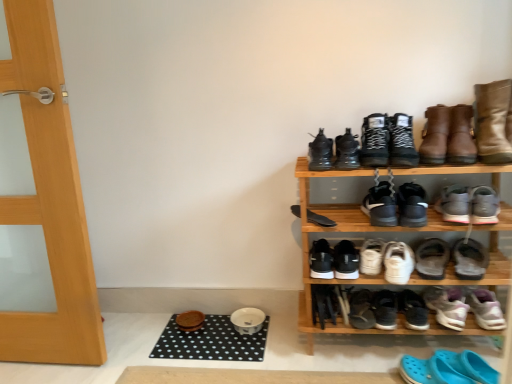
The width and height of the screenshot is (512, 384). Describe the element at coordinates (398, 262) in the screenshot. I see `white matte sneakers at center-right, placed as the thirteenth footwear when sorted from top to bottom` at that location.

What do you see at coordinates (321, 260) in the screenshot? The height and width of the screenshot is (384, 512). I see `black matte shoe at lower center, the seventh footwear when ordered from bottom to top` at bounding box center [321, 260].

What do you see at coordinates (470, 259) in the screenshot? Image resolution: width=512 pixels, height=384 pixels. I see `white suede sneaker at lower right, the eleventh footwear positioned from the top` at bounding box center [470, 259].

Identify the location of white matte sneakers at center, the 6th footwear ordered from the bottom. (x=432, y=258).

The image size is (512, 384). What do you see at coordinates (492, 121) in the screenshot? I see `leather boots at upper right, placed as the 20th footwear when sorted from bottom to top` at bounding box center [492, 121].

Describe the element at coordinates (49, 200) in the screenshot. I see `wooden door at left` at that location.

At what (x,y) coordinates should I click in order to perform the action: click on white matte sneakers at center-right, the eighth footwear when ordered from bottom to top. Please return your answer as a coordinate pair (x, y). The image size is (512, 384). Looking at the image, I should click on (398, 262).

From the image's perspective, which one is positioned higher, black dotted mat at lower center, the 2th doormat from the front, or black matte shoe at lower center, the 2th footwear from the bottom?

black matte shoe at lower center, the 2th footwear from the bottom, appears higher in the image.

From a real-world perspective, between black dotted mat at lower center, the first doormat in the back-to-front sequence, and black matte shoe at lower center, the nineteenth footwear positioned from the top, who is vertically lower?

From a 3D spatial view, black dotted mat at lower center, the first doormat in the back-to-front sequence, is below.

From the black dotted mat at lower center, the first doormat in the back-to-front sequence, count 1st footwears forward and point to it. Please provide its 2D coordinates.

[(361, 309)]

Looking at this image, between black dotted mat at lower center, the 2th doormat from the front, and black matte shoe at lower center, the 2th footwear from the bottom, which one has smaller width?

Thinner between the two is black matte shoe at lower center, the 2th footwear from the bottom.

Considering the sizes of white matte sneakers at center, which ranks as the 12th footwear in top-to-bottom order, and black suede boots at upper center, the 18th footwear positioned from the bottom, in the image, is white matte sneakers at center, which ranks as the 12th footwear in top-to-bottom order, bigger or smaller than black suede boots at upper center, the 18th footwear positioned from the bottom,?

In the image, white matte sneakers at center, which ranks as the 12th footwear in top-to-bottom order, appears to be smaller than black suede boots at upper center, the 18th footwear positioned from the bottom.

How different are the orientations of white matte sneakers at center, which ranks as the 12th footwear in top-to-bottom order, and black suede boots at upper center, the 18th footwear positioned from the bottom, in degrees?

There is a 12.6-degree angle between the facing directions of white matte sneakers at center, which ranks as the 12th footwear in top-to-bottom order, and black suede boots at upper center, the 18th footwear positioned from the bottom.

Considering the sizes of white matte sneakers at center, which is counted as the ninth footwear, starting from the bottom, and black suede boots at upper center, which is the third footwear from top to bottom, in the image, is white matte sneakers at center, which is counted as the ninth footwear, starting from the bottom, taller or shorter than black suede boots at upper center, which is the third footwear from top to bottom,?

Clearly, white matte sneakers at center, which is counted as the ninth footwear, starting from the bottom, is shorter compared to black suede boots at upper center, which is the third footwear from top to bottom.

From a real-world perspective, which object rests below the other?

white matte sneakers at center, which is counted as the ninth footwear, starting from the bottom, is physically lower.

Between white suede sneaker at lower right, the eleventh footwear positioned from the top, and white matte sneakers at center, which is counted as the ninth footwear, starting from the bottom, which one has larger size?

white suede sneaker at lower right, the eleventh footwear positioned from the top.

Which is more to the right, white suede sneaker at lower right, the 10th footwear in the bottom-to-top sequence, or white matte sneakers at center, which ranks as the 12th footwear in top-to-bottom order?

white suede sneaker at lower right, the 10th footwear in the bottom-to-top sequence, is more to the right.

Which of these two, white suede sneaker at lower right, the 10th footwear in the bottom-to-top sequence, or white matte sneakers at center, which is counted as the ninth footwear, starting from the bottom, is wider?

white suede sneaker at lower right, the 10th footwear in the bottom-to-top sequence.

Looking at this image, is white suede sneaker at lower right, the 10th footwear in the bottom-to-top sequence, positioned beyond the bounds of white matte sneakers at center, which ranks as the 12th footwear in top-to-bottom order?

Yes, white suede sneaker at lower right, the 10th footwear in the bottom-to-top sequence, is located beyond the bounds of white matte sneakers at center, which ranks as the 12th footwear in top-to-bottom order.

Would you say leather boots at upper right, placed as the 20th footwear when sorted from bottom to top, is a long distance from shiny black boot at upper center, positioned as the 16th footwear in bottom-to-top order?

No, there isn't a large distance between leather boots at upper right, placed as the 20th footwear when sorted from bottom to top, and shiny black boot at upper center, positioned as the 16th footwear in bottom-to-top order.

Is leather boots at upper right, the first footwear positioned from the top, oriented away from shiny black boot at upper center, positioned as the 16th footwear in bottom-to-top order?

No, shiny black boot at upper center, positioned as the 16th footwear in bottom-to-top order, is not at the back of leather boots at upper right, the first footwear positioned from the top.

From the image's perspective, would you say leather boots at upper right, placed as the 20th footwear when sorted from bottom to top, is shown under shiny black boot at upper center, which is the 5th footwear in top-to-bottom order?

No, from the image's perspective, leather boots at upper right, placed as the 20th footwear when sorted from bottom to top, is not beneath shiny black boot at upper center, which is the 5th footwear in top-to-bottom order.

Which is in front, point (501, 113) or point (309, 157)?

Positioned in front is point (501, 113).

Looking at this image, is black leather sneakers at upper center, the 19th footwear in the bottom-to-top sequence, in front of black matte sneakers at lower center, marked as the 3th footwear in a bottom-to-top arrangement?

Yes.

Can we say black leather sneakers at upper center, the 19th footwear in the bottom-to-top sequence, lies outside black matte sneakers at lower center, marked as the 3th footwear in a bottom-to-top arrangement?

Yes, black leather sneakers at upper center, the 19th footwear in the bottom-to-top sequence, is not within black matte sneakers at lower center, marked as the 3th footwear in a bottom-to-top arrangement.

How much distance is there between black leather sneakers at upper center, which ranks as the second footwear in top-to-bottom order, and black matte sneakers at lower center, marked as the 3th footwear in a bottom-to-top arrangement?

black leather sneakers at upper center, which ranks as the second footwear in top-to-bottom order, is 22.78 inches away from black matte sneakers at lower center, marked as the 3th footwear in a bottom-to-top arrangement.

Which is more distant, (x=385, y=124) or (x=391, y=314)?

The point (x=391, y=314) is farther from the camera.

Is white matte sneakers at center, the fifteenth footwear viewed from the top, smaller than black matte sneakers at center, the tenth footwear from the top?

Actually, white matte sneakers at center, the fifteenth footwear viewed from the top, might be larger than black matte sneakers at center, the tenth footwear from the top.

Which is in front, point (437, 270) or point (353, 252)?

Point (437, 270)

Can we say white matte sneakers at center, the fifteenth footwear viewed from the top, lies outside black matte sneakers at center, positioned as the eleventh footwear in bottom-to-top order?

That's correct, white matte sneakers at center, the fifteenth footwear viewed from the top, is outside of black matte sneakers at center, positioned as the eleventh footwear in bottom-to-top order.

Considering the sizes of objects white matte sneakers at center, the fifteenth footwear viewed from the top, and black matte sneakers at center, the tenth footwear from the top, in the image provided, who is wider, white matte sneakers at center, the fifteenth footwear viewed from the top, or black matte sneakers at center, the tenth footwear from the top,?

Wider between the two is white matte sneakers at center, the fifteenth footwear viewed from the top.

Which object is positioned more to the right, black mesh shoe at center, placed as the seventh footwear when sorted from top to bottom, or blue rubber clogs at lower right, which is the 1th footwear from bottom to top?

Positioned to the right is blue rubber clogs at lower right, which is the 1th footwear from bottom to top.

This screenshot has width=512, height=384. There is a black mesh shoe at center, placed as the seventh footwear when sorted from top to bottom. What are the coordinates of `the 13th footwear below it (from the image's perspective)` in the screenshot? It's located at (448, 369).

In terms of height, does black mesh shoe at center, placed as the seventh footwear when sorted from top to bottom, look taller or shorter compared to blue rubber clogs at lower right, arranged as the 20th footwear when viewed from the top?

In the image, black mesh shoe at center, placed as the seventh footwear when sorted from top to bottom, appears to be taller than blue rubber clogs at lower right, arranged as the 20th footwear when viewed from the top.

In the scene shown: Is black mesh shoe at center, placed as the seventh footwear when sorted from top to bottom, further to camera compared to blue rubber clogs at lower right, arranged as the 20th footwear when viewed from the top?

Yes, black mesh shoe at center, placed as the seventh footwear when sorted from top to bottom, is further from the camera.

The width and height of the screenshot is (512, 384). Identify the location of the 2nd doormat to the left of the black matte shoe at lower center, the 2th footwear from the bottom, starting your count from the anchor. (211, 341).

Locate an element on the screen. Image resolution: width=512 pixels, height=384 pixels. the 10th footwear located beneath the black suede boots at upper center, which is the third footwear from top to bottom (from a real-world perspective) is located at coordinates (372, 256).

In the scene shown: Which object lies further to the anchor point shiny black boot at upper center, positioned as the 16th footwear in bottom-to-top order, purple suede sneakers at lower right, acting as the 16th footwear starting from the top, or black rubber doormat at lower center, which is the 2th doormat from back to front?

Among the two, black rubber doormat at lower center, which is the 2th doormat from back to front, is located further to shiny black boot at upper center, positioned as the 16th footwear in bottom-to-top order.

When comparing their distances from shiny black boot at upper center, which is the 5th footwear in top-to-bottom order, does black rubber doormat at lower center, positioned as the first doormat in front-to-back order, or brown leather boot at upper right seem further?

Among the two, black rubber doormat at lower center, positioned as the first doormat in front-to-back order, is located further to shiny black boot at upper center, which is the 5th footwear in top-to-bottom order.

Based on their spatial positions, is white suede sneaker at lower right, the 10th footwear in the bottom-to-top sequence, or black matte sneakers at center, the tenth footwear from the top, further from black rubber doormat at lower center, positioned as the first doormat in front-to-back order?

white suede sneaker at lower right, the 10th footwear in the bottom-to-top sequence, is further to black rubber doormat at lower center, positioned as the first doormat in front-to-back order.

From the image, which object appears to be farther from black matte shoe at lower center, the seventh footwear when ordered from bottom to top, purple suede sneakers at lower right, acting as the 16th footwear starting from the top, or black dotted mat at lower center, the first doormat in the back-to-front sequence?

Among the two, black dotted mat at lower center, the first doormat in the back-to-front sequence, is located further to black matte shoe at lower center, the seventh footwear when ordered from bottom to top.

Consider the image. Which object lies further to the anchor point gray suede sneakers at center right, which appears as the eighth footwear when viewed from the top, white matte sneakers at center, the fifteenth footwear viewed from the top, or wooden door at left?

wooden door at left is positioned further to the anchor gray suede sneakers at center right, which appears as the eighth footwear when viewed from the top.

Estimate the real-world distances between objects in this image. Which object is closer to black matte skateboard at center, acting as the twelfth footwear starting from the bottom, wooden door at left or black mesh shoe at center, placed as the seventh footwear when sorted from top to bottom?

black mesh shoe at center, placed as the seventh footwear when sorted from top to bottom, lies closer to black matte skateboard at center, acting as the twelfth footwear starting from the bottom, than the other object.

Based on their spatial positions, is black matte sneakers at center, which appears as the 6th footwear when viewed from the top, or blue rubber clogs at lower right, which is the 1th footwear from bottom to top, further from wooden door at left?

blue rubber clogs at lower right, which is the 1th footwear from bottom to top.

Consider the image. From the image, which object appears to be farther from gray suede sneakers at center right, the 13th footwear ordered from the bottom, white matte sneakers at center, the fifteenth footwear viewed from the top, or black rubber doormat at lower center, positioned as the first doormat in front-to-back order?

Based on the image, black rubber doormat at lower center, positioned as the first doormat in front-to-back order, appears to be further to gray suede sneakers at center right, the 13th footwear ordered from the bottom.

The image size is (512, 384). In order to click on boot between black dotted mat at lower center, the 2th doormat from the front, and gray suede sneakers at center right, the 13th footwear ordered from the bottom, in the horizontal direction in this screenshot , I will do `click(461, 136)`.

Find the location of `shelf between black matte sneakers at lower center, which is counted as the 18th footwear, starting from the top, and purple suede sneakers at lower right, which appears as the 5th footwear when ordered from the bottom, from left to right`. shelf between black matte sneakers at lower center, which is counted as the 18th footwear, starting from the top, and purple suede sneakers at lower right, which appears as the 5th footwear when ordered from the bottom, from left to right is located at coordinates (348, 232).

At what (x,y) coordinates should I click in order to perform the action: click on boot that lies between leather boots at upper right, the first footwear positioned from the top, and black matte sneakers at center, arranged as the 15th footwear when ordered from the bottom, from top to bottom. Please return your answer as a coordinate pair (x, y). Looking at the image, I should click on [x=461, y=136].

At what (x,y) coordinates should I click in order to perform the action: click on doormat between black matte skateboard at center, acting as the twelfth footwear starting from the bottom, and black rubber doormat at lower center, positioned as the first doormat in front-to-back order, from top to bottom. Please return your answer as a coordinate pair (x, y). The height and width of the screenshot is (384, 512). Looking at the image, I should click on (211, 341).